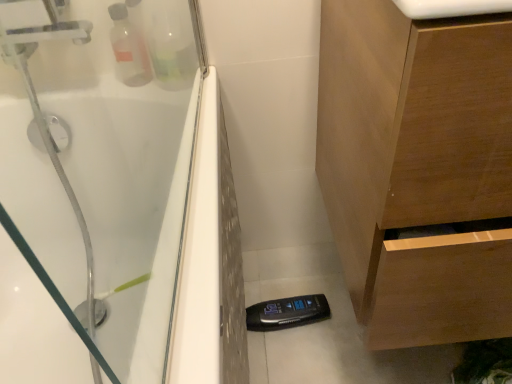
Question: From the image's perspective, is white glossy sink at upper center positioned above or below wooden cabinet at lower right?

Choices:
 (A) below
 (B) above

Answer: (B)

Question: Do you think white glossy sink at upper center is within wooden cabinet at lower right, or outside of it?

Choices:
 (A) outside
 (B) inside

Answer: (A)

Question: From a real-world perspective, is white glossy sink at upper center positioned above or below wooden cabinet at lower right?

Choices:
 (A) below
 (B) above

Answer: (B)

Question: Considering the positions of wooden cabinet at lower right and white glossy sink at upper center in the image, is wooden cabinet at lower right taller or shorter than white glossy sink at upper center?

Choices:
 (A) tall
 (B) short

Answer: (A)

Question: From a real-world perspective, is wooden cabinet at lower right physically located above or below white glossy sink at upper center?

Choices:
 (A) above
 (B) below

Answer: (B)

Question: Considering the positions of wooden cabinet at lower right and white glossy sink at upper center in the image, is wooden cabinet at lower right bigger or smaller than white glossy sink at upper center?

Choices:
 (A) small
 (B) big

Answer: (B)

Question: From the image's perspective, is wooden cabinet at lower right above or below white glossy sink at upper center?

Choices:
 (A) below
 (B) above

Answer: (A)